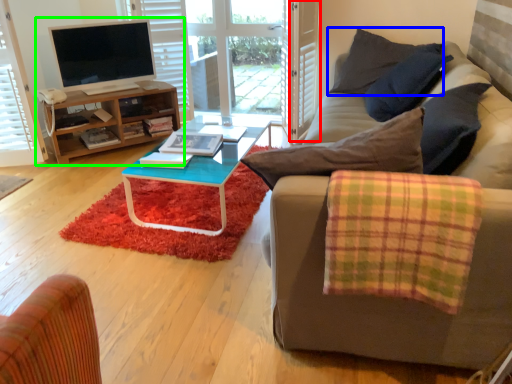
Question: Based on their relative distances, which object is farther from screen door (highlighted by a red box)? Choose from pillow (highlighted by a blue box) and entertainment center (highlighted by a green box).

Choices:
 (A) pillow
 (B) entertainment center

Answer: (B)